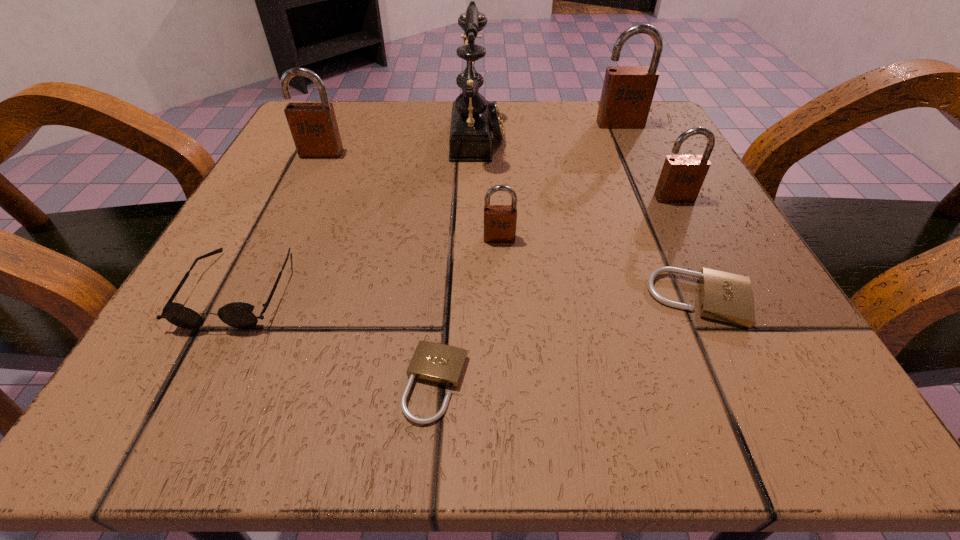
The width and height of the screenshot is (960, 540). I want to click on free space between the farthest padlock and the third shortest object, so click(x=430, y=206).

Find the location of a particular element. The image size is (960, 540). empty location between the third farthest padlock and the left beige padlock is located at coordinates (555, 291).

The image size is (960, 540). I want to click on vacant point located between the sunglasses and the third shortest padlock, so click(x=370, y=264).

Identify the location of vacant space that is in between the third nearest padlock and the telephone. (489, 187).

This screenshot has width=960, height=540. I want to click on free spot between the biggest brown padlock and the nearer beige padlock, so click(x=528, y=254).

I want to click on object that can be found as the closest to the sixth shortest object, so click(x=474, y=119).

Identify which object is located as the second nearest to the sunglasses. Please provide its 2D coordinates. Your answer should be formatted as a tuple, i.e. [(x, y)], where the tuple contains the x and y coordinates of a point satisfying the conditions above.

[(314, 128)]

In order to click on padlock that is the fifth nearest to the nearest object in this screenshot , I will do `click(627, 93)`.

Locate which padlock is the fifth closest to the farthest padlock. Please provide its 2D coordinates. Your answer should be formatted as a tuple, i.e. [(x, y)], where the tuple contains the x and y coordinates of a point satisfying the conditions above.

[(441, 364)]

At what (x,y) coordinates should I click in order to perform the action: click on brown padlock that can be found as the second closest to the leftmost padlock. Please return your answer as a coordinate pair (x, y). The width and height of the screenshot is (960, 540). Looking at the image, I should click on (627, 93).